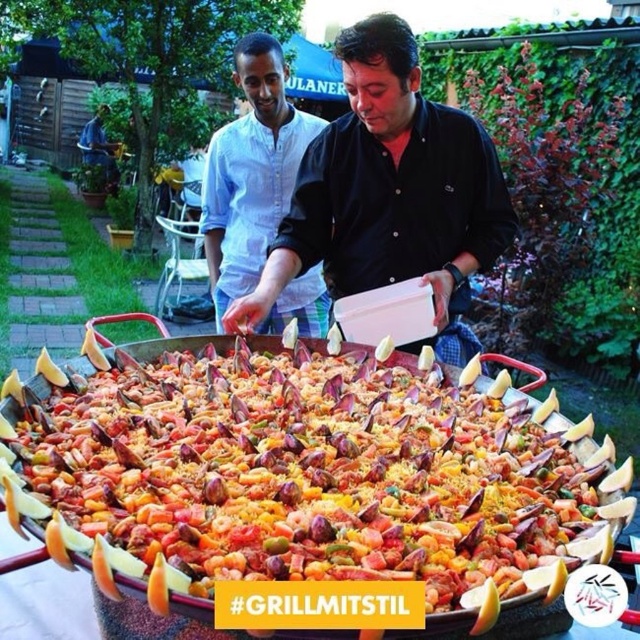
You are standing at the center of the paella dish. You want to reach the point at coordinates point (307, 476). In which direction should you move?

The point (307, 476) is on the multicolored rice at center, so you are already at the desired location. No movement is needed.

You are at a paella serving event and want to take a photo of the multicolored rice at center and the black matte shirt at center. Which object should you focus on if you want to capture the wider subject?

The multicolored rice at center is wider than the black matte shirt at center, so you should focus on the multicolored rice at center to capture the wider subject.